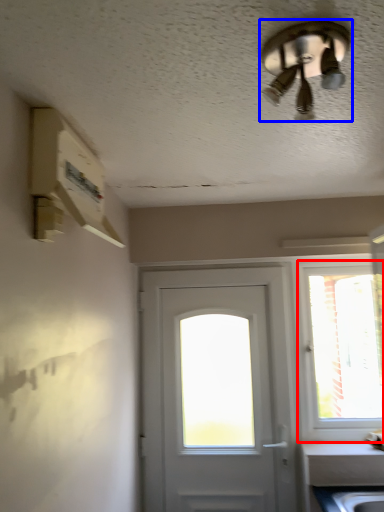
Question: Which of the following is the farthest to the observer, window (highlighted by a red box) or ceiling fan (highlighted by a blue box)?

Choices:
 (A) window
 (B) ceiling fan

Answer: (A)